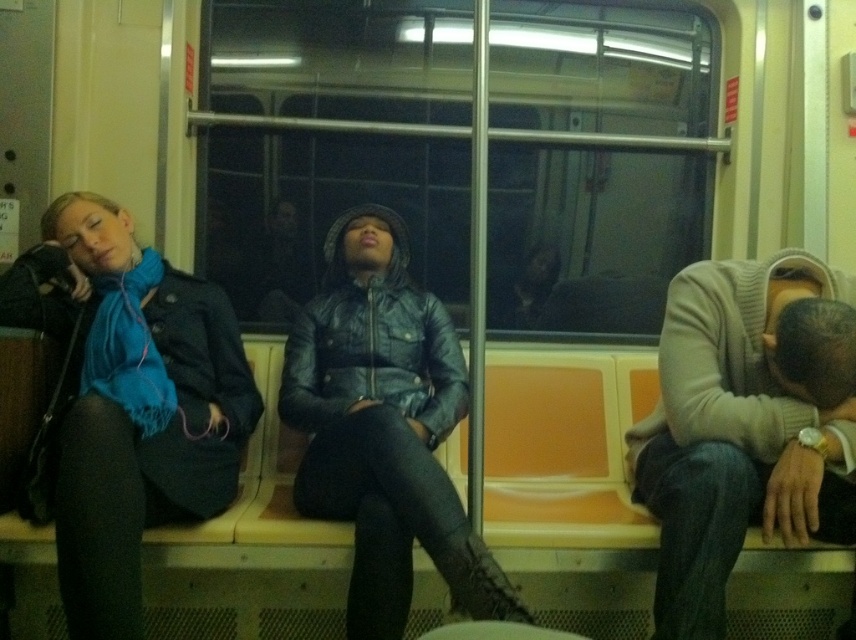
Looking at this image, you are a passenger on the subway and want to know if the light gray sweater at right will fit into a storage compartment that can only hold items thinner than the leather jacket at center. Can it fit?

The light gray sweater at right is thinner than the leather jacket at center, so it should fit into the storage compartment.

Consider the image. You are a passenger trying to find a seat in the subway car. You see the point marked at coordinates (140, 413). Which object is located at that point?

The point at coordinates (140, 413) corresponds to the matte black coat at left.

You are standing on the subway car and want to reach the matte black coat at left to retrieve your scarf accidentally dropped there. Considering your height is 1.7 meters, can you comfortably reach the coat without stretching too much?

The matte black coat at left is 1.62 meters away from the viewer. Since the distance is less than your height, you can comfortably reach it without stretching too much.